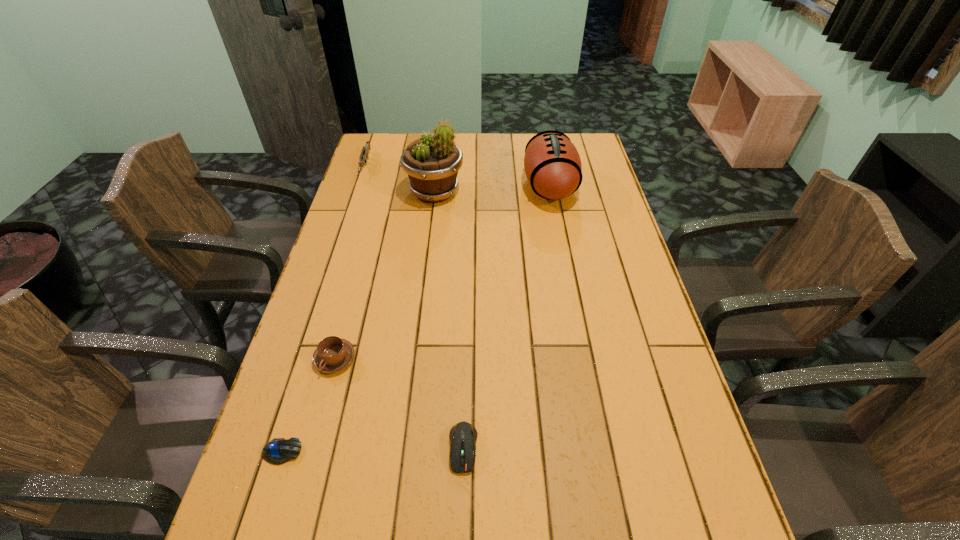
The width and height of the screenshot is (960, 540). Find the location of `computer mouse situated at the left edge`. computer mouse situated at the left edge is located at coordinates (279, 450).

This screenshot has height=540, width=960. In order to click on object that is at the right edge in this screenshot , I will do `click(552, 164)`.

At what (x,y) coordinates should I click in order to perform the action: click on object located at the far left corner. Please return your answer as a coordinate pair (x, y). This screenshot has width=960, height=540. Looking at the image, I should click on (364, 156).

Locate an element on the screen. The height and width of the screenshot is (540, 960). object at the far right corner is located at coordinates (552, 164).

I want to click on free space at the far edge of the desktop, so pos(514,156).

The image size is (960, 540). In the image, there is a desktop. In order to click on vacant space at the left edge in this screenshot , I will do `click(388, 201)`.

The height and width of the screenshot is (540, 960). What are the coordinates of `free space at the right edge of the desktop` in the screenshot? It's located at (694, 493).

Where is `vacant space at the far right corner`? vacant space at the far right corner is located at coordinates (582, 159).

Where is `free space between the shortest object and the gun`? The image size is (960, 540). free space between the shortest object and the gun is located at coordinates (324, 309).

Find the location of `empty space that is in between the shorter computer mouse and the tallest object`. empty space that is in between the shorter computer mouse and the tallest object is located at coordinates (358, 322).